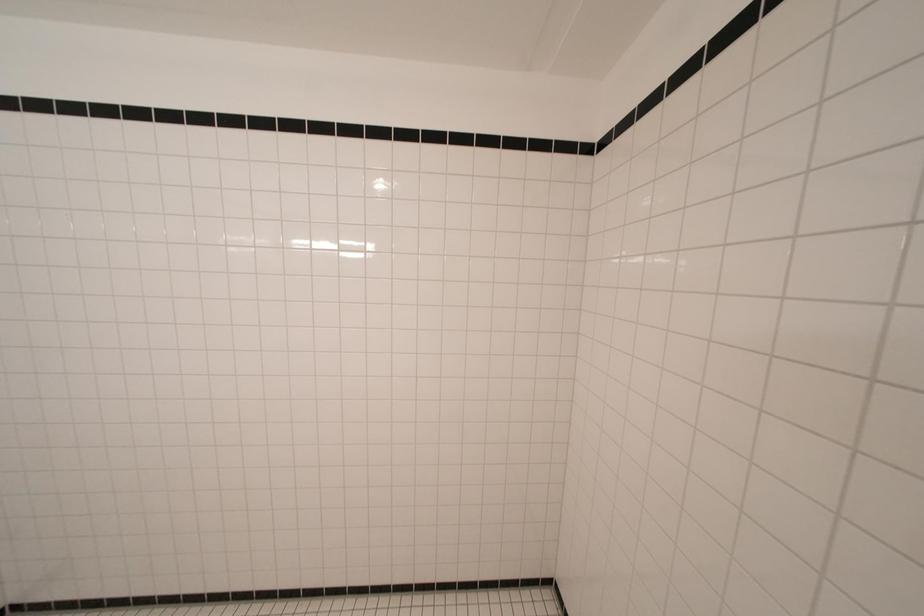
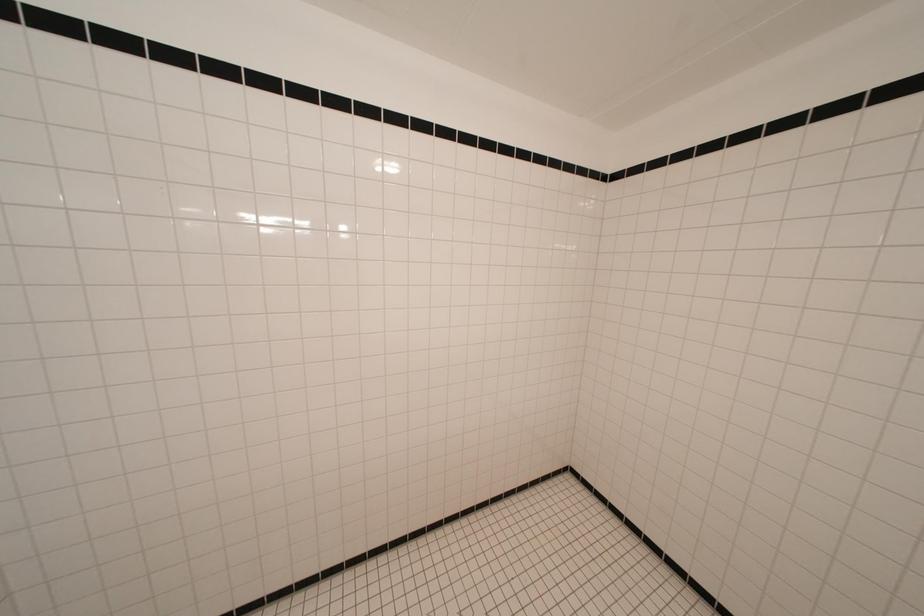
Question: Based on the continuous images, in which direction is the camera rotating? Reply with the corresponding letter.

Choices:
 (A) Left
 (B) Right
 (C) Up
 (D) Down

Answer: (B)